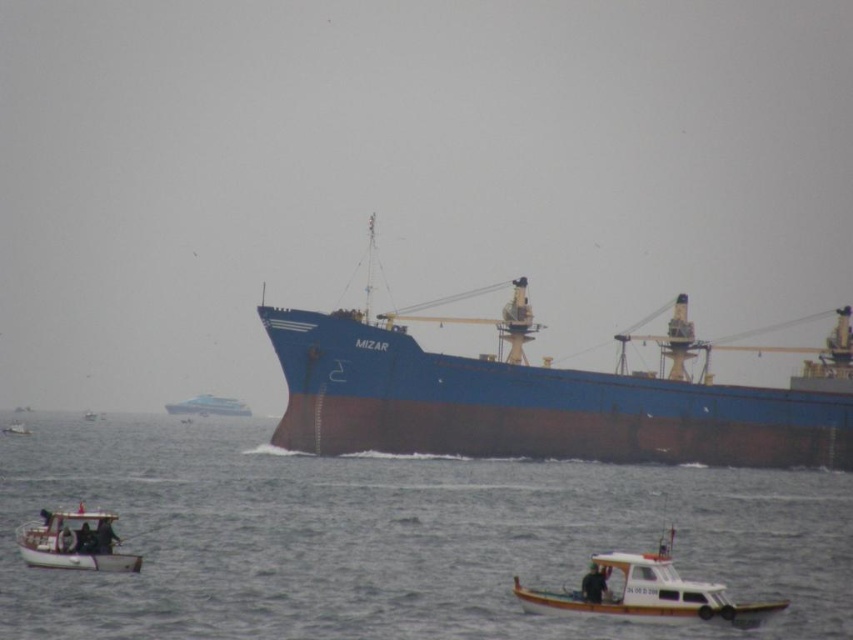
In the scene shown: You are a photographer trying to capture the blue matte cargo ship at center and the white plastic boat at lower right in a single frame. Considering their heights, which one will appear taller in the photo?

The blue matte cargo ship at center appears taller in the photo because it has a greater height compared to the white plastic boat at lower right.

Based on the photo, you are a photographer taking a picture of the brown matte water at center and the blue matte cargo ship at center. Which object should you zoom in on to capture more details of the narrower one?

The blue matte cargo ship at center is narrower than the brown matte water at center, so you should zoom in on the blue matte cargo ship at center to capture more details of the narrower one.

You are a sailor on the white plastic boat at lower right and want to signal the blue matte cargo ship at center. In which direction should you aim your signal?

The blue matte cargo ship at center is to the left of the white plastic boat at lower right, so you should aim your signal to the left direction.